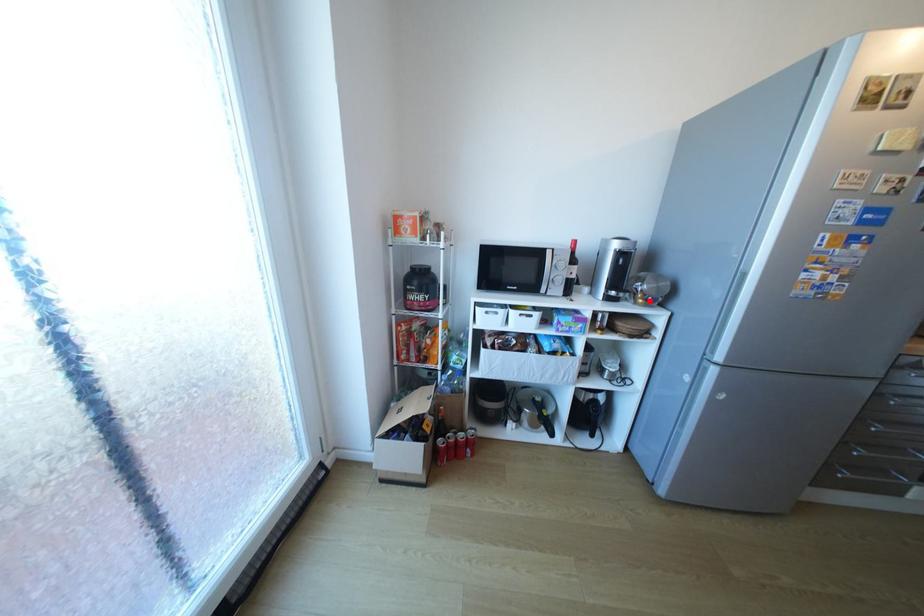
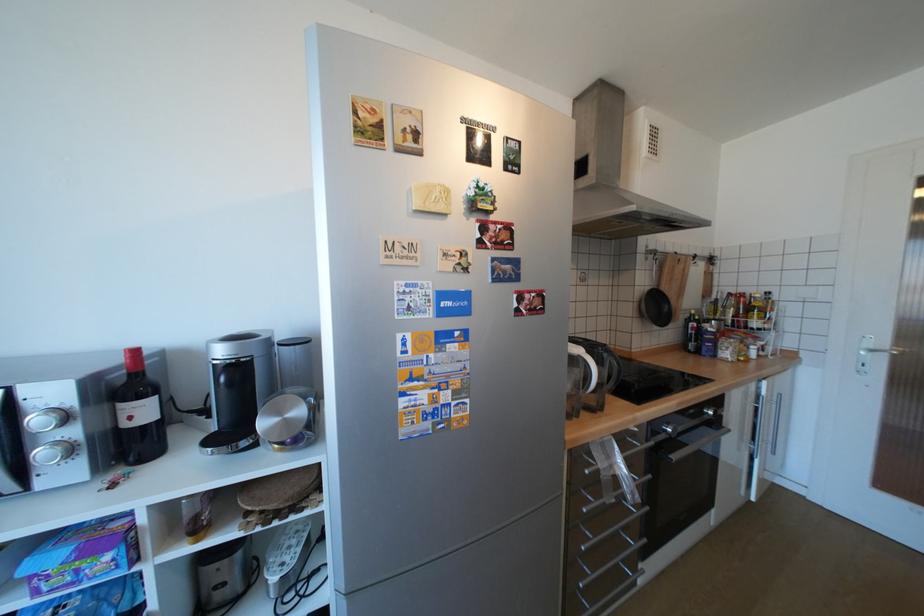
Where in the second image is the point corresponding to the highlighted location from the first image?

(286, 446)